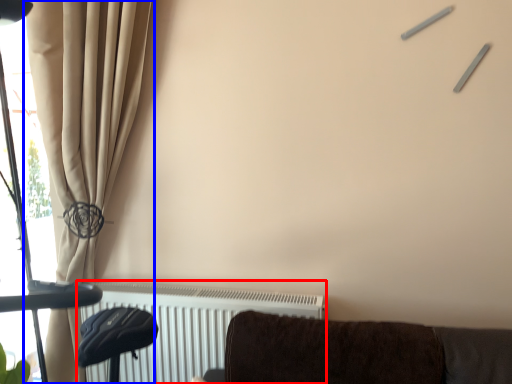
Question: Which point is closer to the camera, radiator (highlighted by a red box) or curtain (highlighted by a blue box)?

Choices:
 (A) radiator
 (B) curtain

Answer: (B)